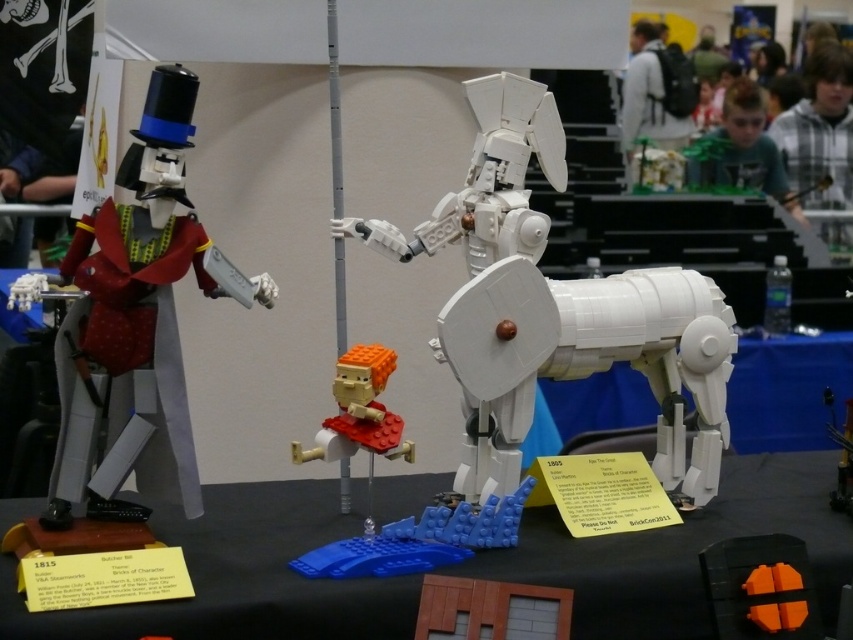
Which is in front, point (572, 628) or point (374, 353)?

Point (572, 628) is in front.

Is black plastic table at center shorter than translucent orange plastic figure at center?

Indeed, black plastic table at center has a lesser height compared to translucent orange plastic figure at center.

The width and height of the screenshot is (853, 640). I want to click on black plastic table at center, so click(241, 577).

I want to click on black plastic table at center, so click(x=241, y=577).

Is white matte robot at center above translucent orange plastic figure at center?

Yes, white matte robot at center is above translucent orange plastic figure at center.

This screenshot has width=853, height=640. Find the location of `white matte robot at center`. white matte robot at center is located at coordinates (556, 308).

Is black plastic table at center closer to camera compared to matte black figure at left?

Yes, black plastic table at center is in front of matte black figure at left.

Between point (688, 620) and point (102, 352), which one is positioned behind?

The point (688, 620) is more distant.

The width and height of the screenshot is (853, 640). Find the location of `black plastic table at center`. black plastic table at center is located at coordinates pos(241,577).